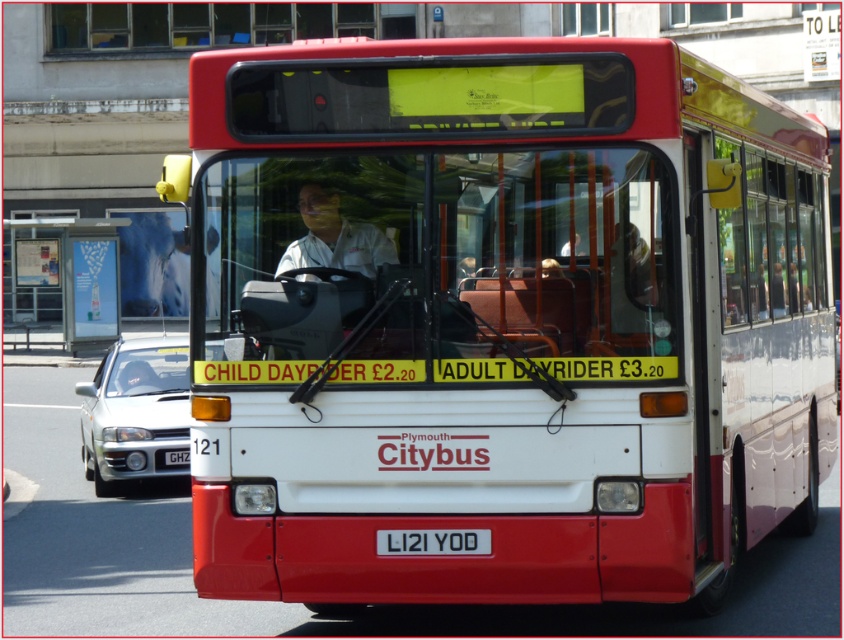
You are a pedestrian standing at the white plastic bus stop at upper left and want to cross the street to reach the matte white bus at center. Considering the width of both objects, will you have enough space to safely walk between them without touching either?

The matte white bus at center is thinner than the white plastic bus stop at upper left, so there should be sufficient space between them for a pedestrian to walk safely without touching either object.

What are the coordinates of the matte white bus at center?

The matte white bus at center is located at point [502,321].

Based on the photo, you are a passenger waiting at the bus stop. You see the matte white bus at center and the white rectangular at center. Which object is closer to you?

The matte white bus at center is closer to you because the white rectangular at center is behind it.